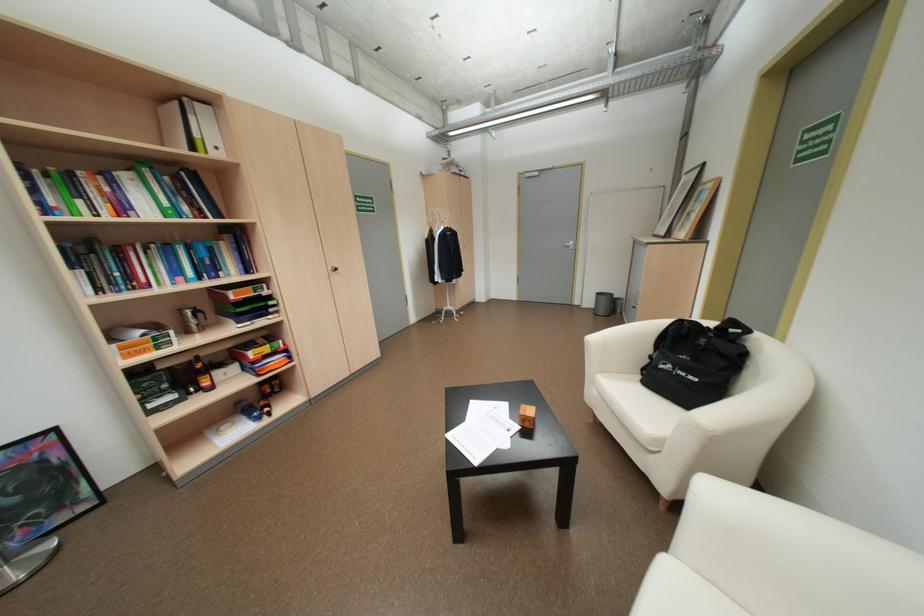
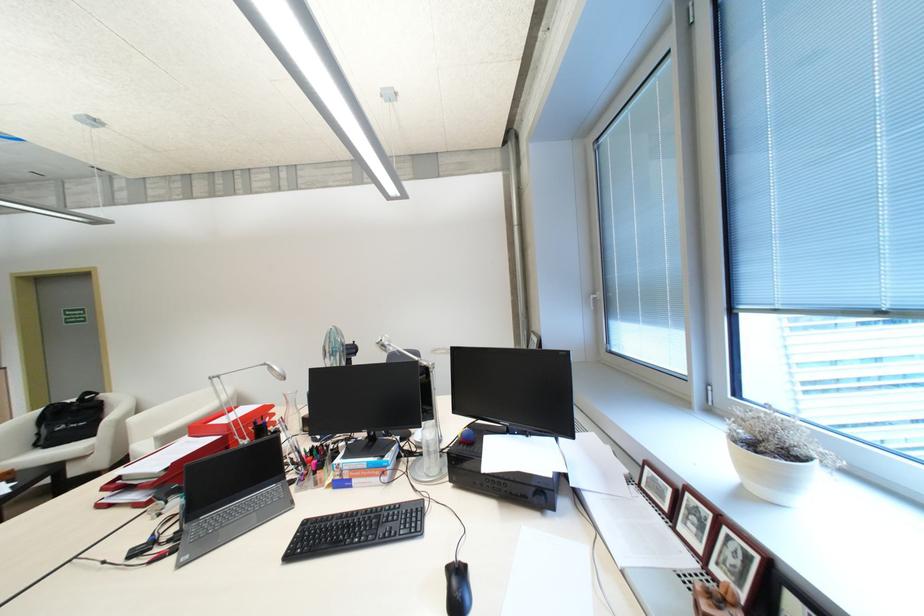
Find the pixel in the second image that matches point (720, 323) in the first image.

(82, 399)